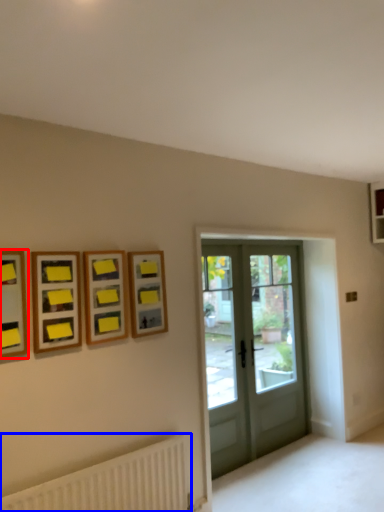
Question: Among these objects, which one is nearest to the camera, picture frame (highlighted by a red box) or radiator (highlighted by a blue box)?

Choices:
 (A) picture frame
 (B) radiator

Answer: (B)